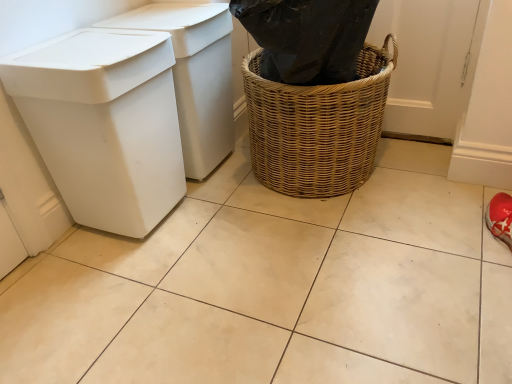
Where is `free spot above white plastic bin at left, the first waste container in the back-to-front sequence (from a real-world perspective)`? free spot above white plastic bin at left, the first waste container in the back-to-front sequence (from a real-world perspective) is located at coordinates (159, 19).